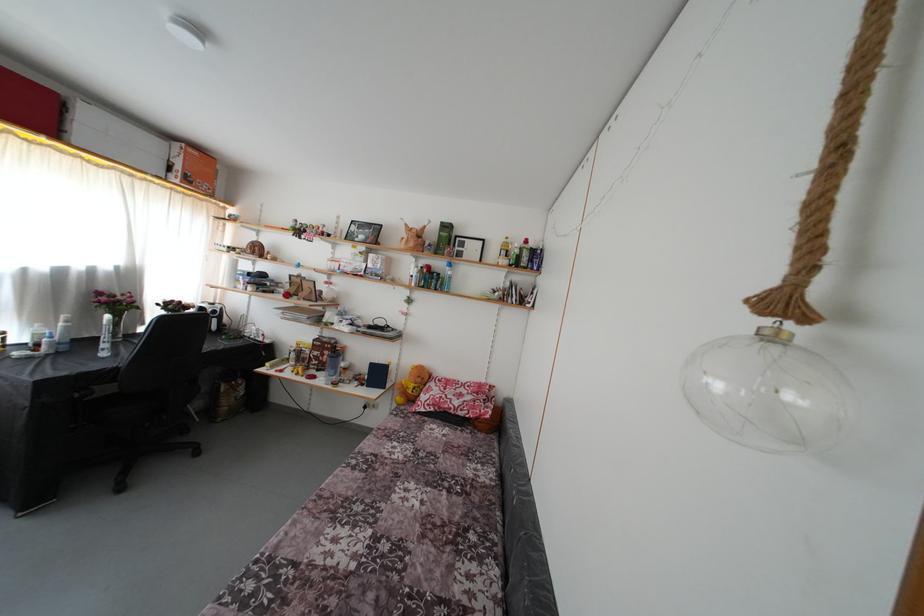
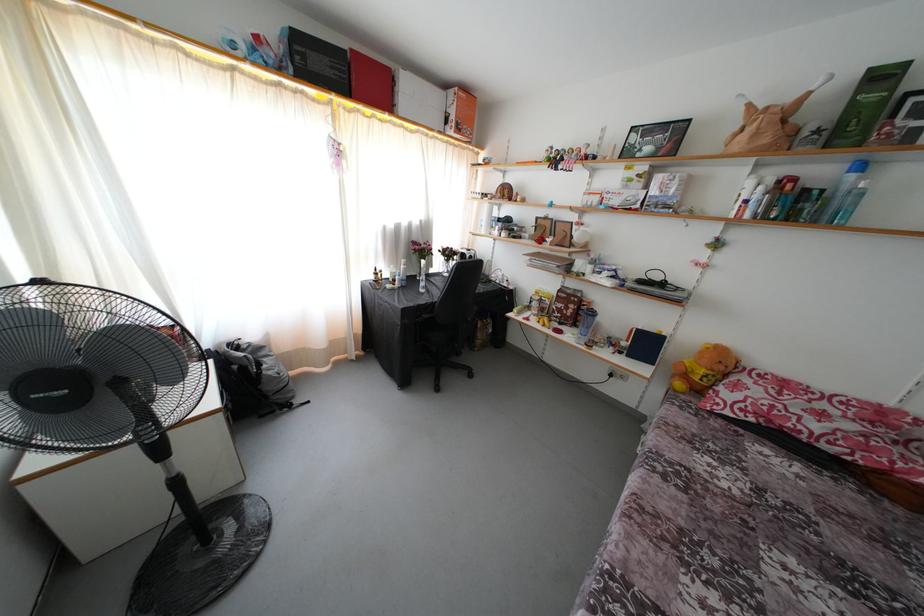
Question: I am providing you with two images of the same scene from different viewpoints. Please identify which objects are invisible in image2.

Choices:
 (A) red cardboard box
 (B) white cardboard box
 (C) orange cardboard box
 (D) none of these

Answer: (D)